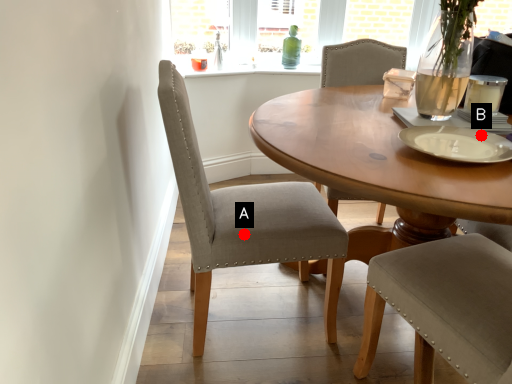
Question: Two points are circled on the image, labeled by A and B beside each circle. Which of the following is the closest to the observer?

Choices:
 (A) A is closer
 (B) B is closer

Answer: (B)